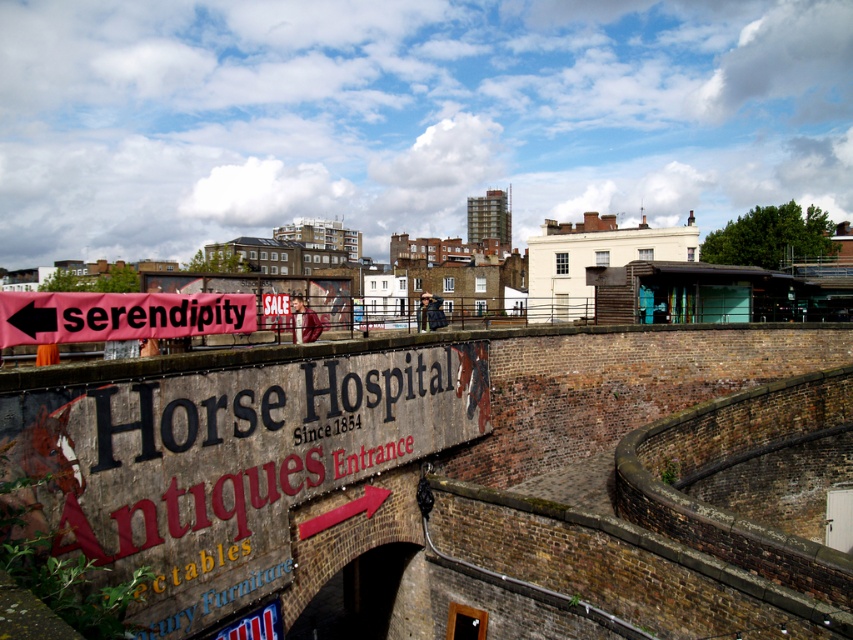
Question: Which object appears closest to the camera in this image?

Choices:
 (A) brick wall at center
 (B) pink fabric banner at left

Answer: (A)

Question: Is brick wall at center positioned in front of pink fabric banner at left?

Choices:
 (A) no
 (B) yes

Answer: (B)

Question: Which point is farther to the camera?

Choices:
 (A) (505, 486)
 (B) (9, 300)

Answer: (A)

Question: Is brick wall at center to the left of pink fabric banner at left from the viewer's perspective?

Choices:
 (A) no
 (B) yes

Answer: (A)

Question: Which of the following is the closest to the observer?

Choices:
 (A) pink fabric banner at left
 (B) brick wall at center

Answer: (B)

Question: Is brick wall at center positioned behind pink fabric banner at left?

Choices:
 (A) no
 (B) yes

Answer: (A)